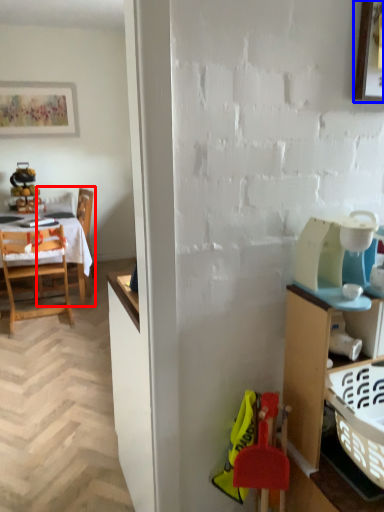
Question: Which object is closer to the camera taking this photo, chair (highlighted by a red box) or picture frame (highlighted by a blue box)?

Choices:
 (A) chair
 (B) picture frame

Answer: (B)